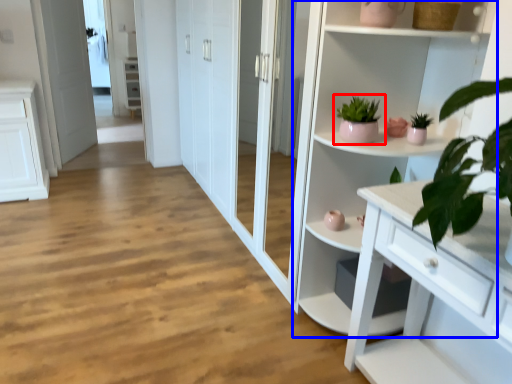
Question: Among these objects, which one is nearest to the camera, houseplant (highlighted by a red box) or cupboard (highlighted by a blue box)?

Choices:
 (A) houseplant
 (B) cupboard

Answer: (B)